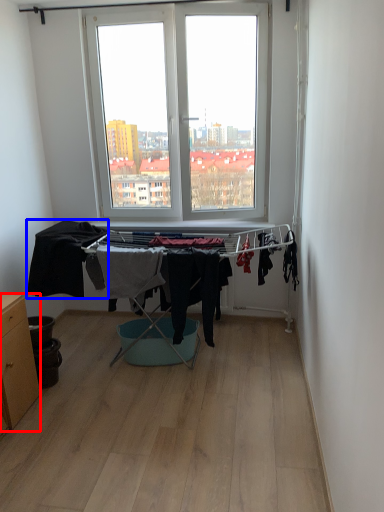
Question: Which point is further to the camera, table (highlighted by a red box) or clothing (highlighted by a blue box)?

Choices:
 (A) table
 (B) clothing

Answer: (B)